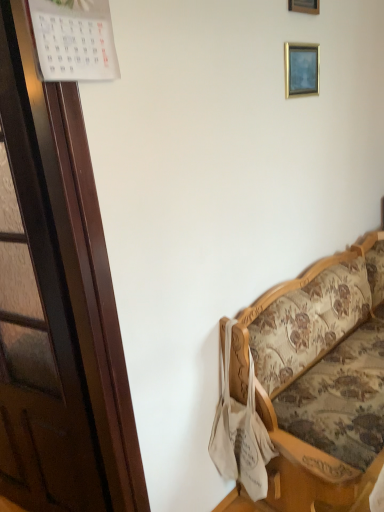
Question: Is floral fabric couch at right shorter than gold metallic picture frame at upper right, which is the 1th picture frame from bottom to top?

Choices:
 (A) yes
 (B) no

Answer: (B)

Question: Can you confirm if floral fabric couch at right is taller than gold metallic picture frame at upper right, which is the 1th picture frame from bottom to top?

Choices:
 (A) no
 (B) yes

Answer: (B)

Question: Could you tell me if floral fabric couch at right is facing gold metallic picture frame at upper right, placed as the second picture frame when sorted from top to bottom?

Choices:
 (A) no
 (B) yes

Answer: (A)

Question: Is floral fabric couch at right turned away from gold metallic picture frame at upper right, placed as the second picture frame when sorted from top to bottom?

Choices:
 (A) no
 (B) yes

Answer: (A)

Question: Is floral fabric couch at right positioned before gold metallic picture frame at upper right, placed as the second picture frame when sorted from top to bottom?

Choices:
 (A) no
 (B) yes

Answer: (B)

Question: Are floral fabric couch at right and gold metallic picture frame at upper right, placed as the second picture frame when sorted from top to bottom, making contact?

Choices:
 (A) yes
 (B) no

Answer: (B)

Question: Does wooden picture frame at upper center, acting as the 2th picture frame starting from the bottom, have a greater width compared to gold metallic picture frame at upper right, which is the 1th picture frame from bottom to top?

Choices:
 (A) no
 (B) yes

Answer: (A)

Question: Considering the relative sizes of wooden picture frame at upper center, acting as the 2th picture frame starting from the bottom, and gold metallic picture frame at upper right, which is the 1th picture frame from bottom to top, in the image provided, is wooden picture frame at upper center, acting as the 2th picture frame starting from the bottom, bigger than gold metallic picture frame at upper right, which is the 1th picture frame from bottom to top,?

Choices:
 (A) yes
 (B) no

Answer: (A)

Question: Is wooden picture frame at upper center, which is the first picture frame from top to bottom, next to gold metallic picture frame at upper right, which is the 1th picture frame from bottom to top, and touching it?

Choices:
 (A) no
 (B) yes

Answer: (A)

Question: Could gold metallic picture frame at upper right, placed as the second picture frame when sorted from top to bottom, be considered to be inside wooden picture frame at upper center, which is the first picture frame from top to bottom?

Choices:
 (A) no
 (B) yes

Answer: (A)

Question: Does wooden picture frame at upper center, acting as the 2th picture frame starting from the bottom, have a lesser width compared to gold metallic picture frame at upper right, placed as the second picture frame when sorted from top to bottom?

Choices:
 (A) yes
 (B) no

Answer: (A)

Question: From a real-world perspective, is wooden picture frame at upper center, which is the first picture frame from top to bottom, beneath gold metallic picture frame at upper right, which is the 1th picture frame from bottom to top?

Choices:
 (A) no
 (B) yes

Answer: (A)

Question: Are wooden picture frame at upper center, acting as the 2th picture frame starting from the bottom, and floral fabric couch at right beside each other?

Choices:
 (A) no
 (B) yes

Answer: (A)